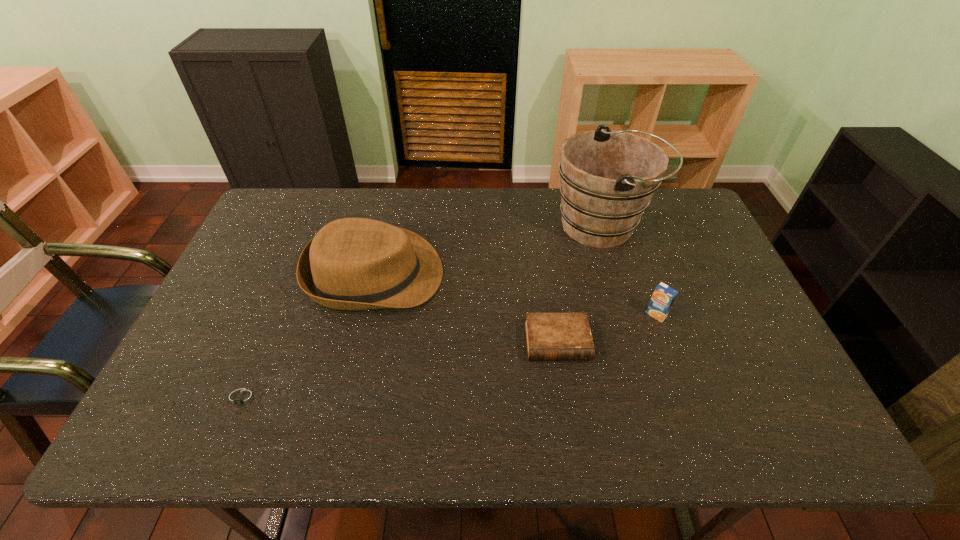
Find the location of `vacant position in the image that satisfies the following two spatial constraints: 1. on the handle side of the tallest object; 2. on the face of the nearest object`. vacant position in the image that satisfies the following two spatial constraints: 1. on the handle side of the tallest object; 2. on the face of the nearest object is located at coordinates (655, 398).

Find the location of a particular element. This screenshot has width=960, height=540. vacant space that satisfies the following two spatial constraints: 1. on the handle side of the bucket; 2. on the spine side of the fourth tallest object is located at coordinates (637, 342).

Locate an element on the screen. Image resolution: width=960 pixels, height=540 pixels. vacant space that satisfies the following two spatial constraints: 1. on the back side of the orange_juice; 2. on the handle side of the tallest object is located at coordinates (625, 226).